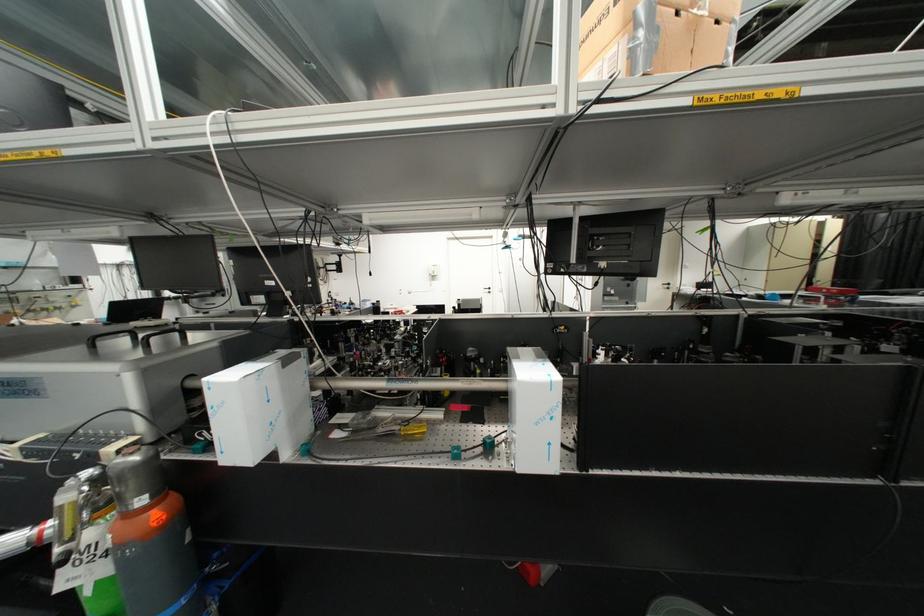
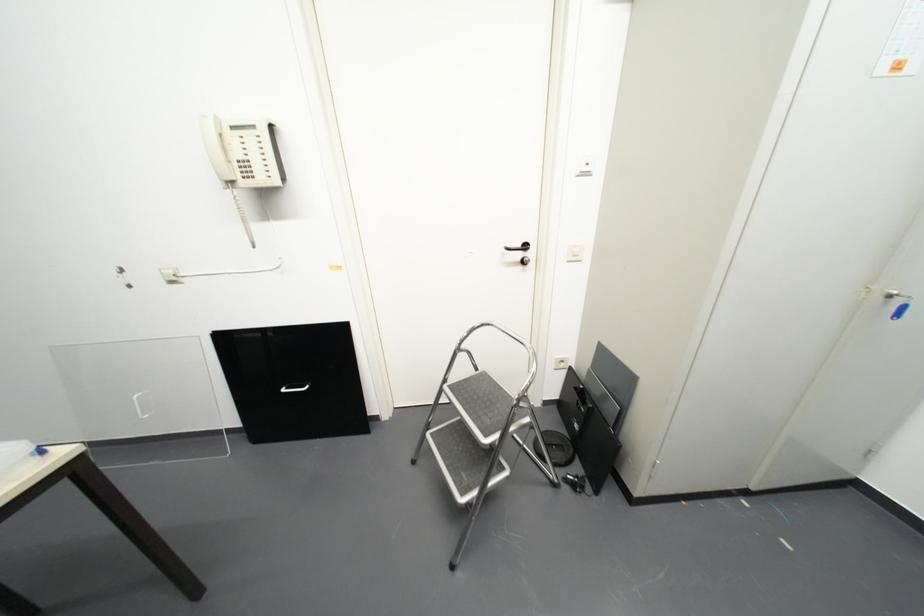
Question: What movement of the cameraman would produce the second image?

Choices:
 (A) Left
 (B) Right
 (C) Forward
 (D) Backward

Answer: (C)